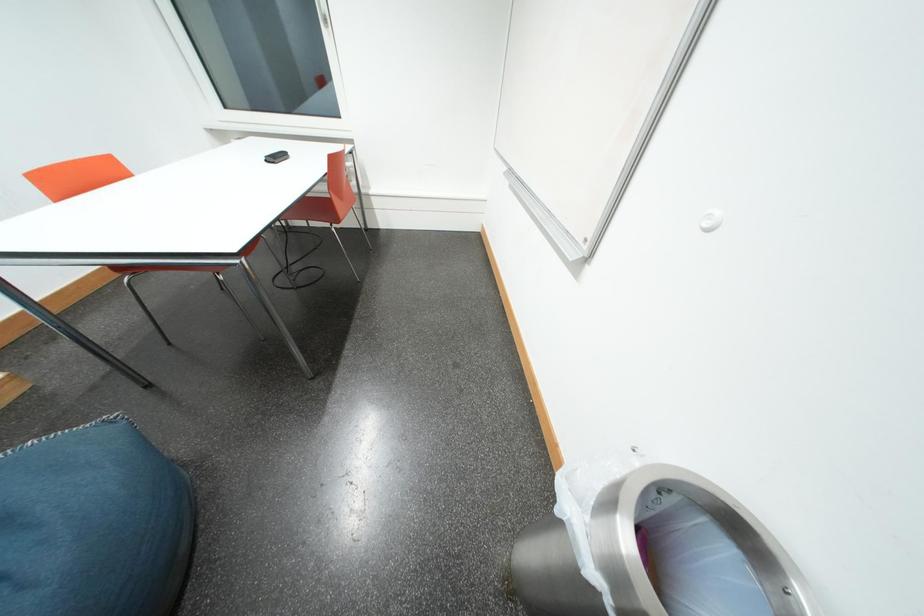
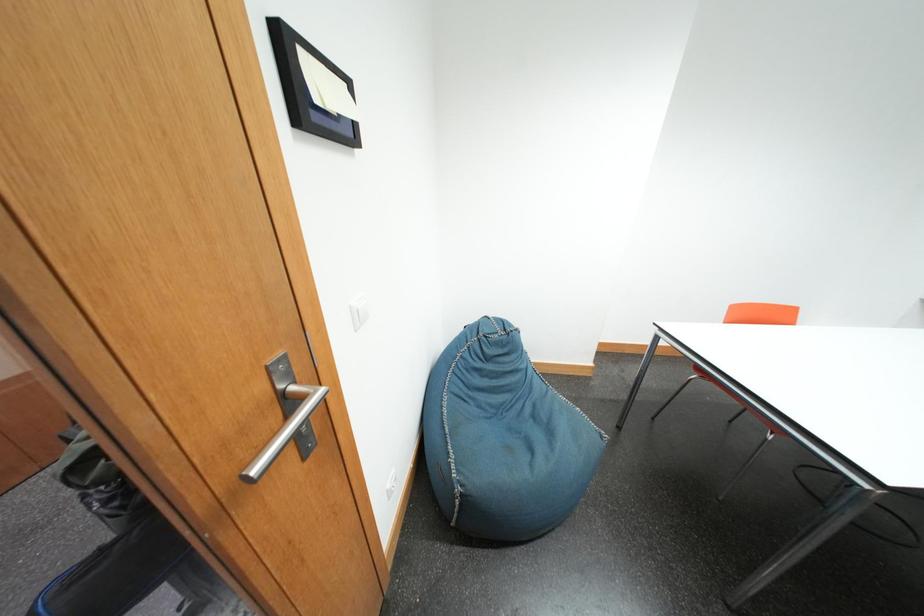
First-person continuous shooting, in which direction is the camera rotating?

The camera rotated toward left-down.